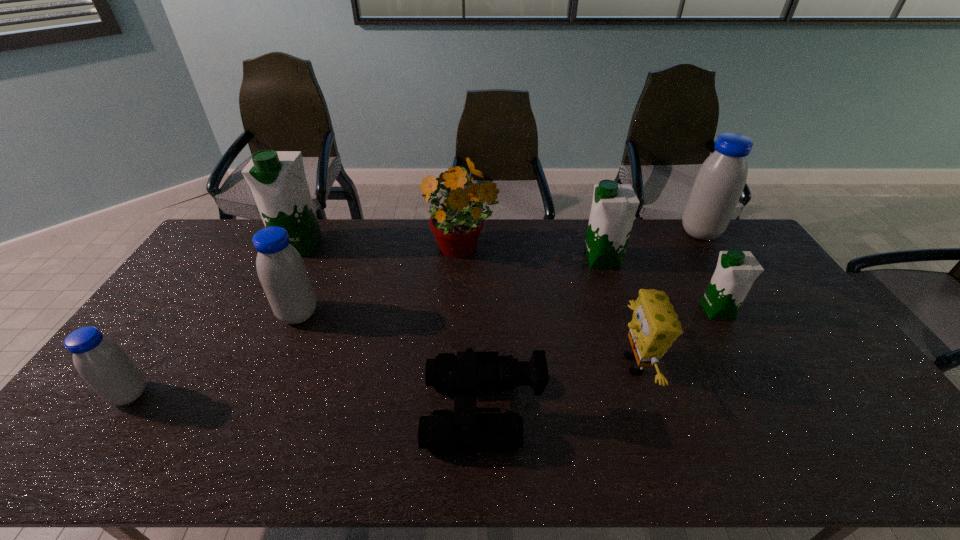
In order to click on vacant point located 0.360m on the left of the second farthest blue soya milk in this screenshot , I will do `click(160, 314)`.

Where is `free space located on the front-facing side of the rightmost green soya milk`? free space located on the front-facing side of the rightmost green soya milk is located at coordinates (656, 311).

In order to click on vacant space located on the front-facing side of the rightmost green soya milk in this screenshot , I will do `click(682, 311)`.

Identify the location of free space located 0.300m on the front-facing side of the rightmost green soya milk. (605, 311).

You are a GUI agent. You are given a task and a screenshot of the screen. Output one action in this format:
    pyautogui.click(x=<x>, y=<y>)
    Task: Click on the free point located on the front of the leftmost object
    
    Given the screenshot: What is the action you would take?
    pyautogui.click(x=95, y=444)

The image size is (960, 540). I want to click on free point located 0.180m on the face of the yellow sponge, so click(550, 364).

Locate an element on the screen. vacant region located on the face of the yellow sponge is located at coordinates (510, 364).

Locate an element on the screen. This screenshot has width=960, height=540. vacant position located on the face of the yellow sponge is located at coordinates (524, 364).

I want to click on vacant space situated on the front lenses of the shortest object, so click(369, 410).

Find the location of a particular element. The height and width of the screenshot is (540, 960). free region located 0.350m on the front lenses of the shortest object is located at coordinates click(x=285, y=410).